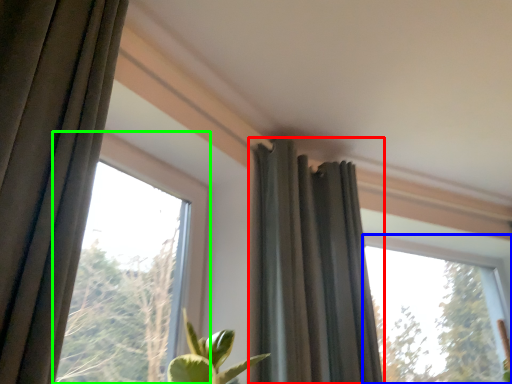
Question: Which object is positioned closest to curtain (highlighted by a red box)? Select from window (highlighted by a blue box) and window (highlighted by a green box).

Choices:
 (A) window
 (B) window

Answer: (B)